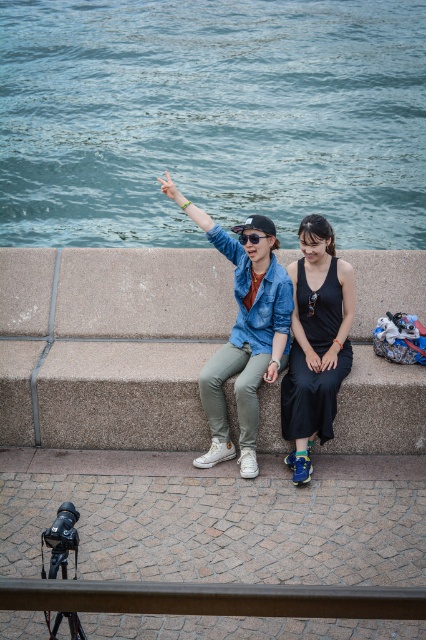
Question: Which point is farther to the camera?

Choices:
 (A) (256, 234)
 (B) (213, 464)
 (C) (100, 300)
 (D) (319, 216)

Answer: (C)

Question: Which is nearer to the blue water at upper center?

Choices:
 (A) concrete ledge at center
 (B) black matte sunglasses at upper center
 (C) denim jacket at center

Answer: (A)

Question: Does blue water at upper center have a greater width compared to black matte sunglasses at upper center?

Choices:
 (A) yes
 (B) no

Answer: (A)

Question: Is concrete ledge at center to the left of denim jacket at center from the viewer's perspective?

Choices:
 (A) no
 (B) yes

Answer: (B)

Question: Is blue water at upper center to the right of concrete ledge at center from the viewer's perspective?

Choices:
 (A) no
 (B) yes

Answer: (A)

Question: Estimate the real-world distances between objects in this image. Which object is closer to the blue water at upper center?

Choices:
 (A) concrete ledge at center
 (B) black matte dress at center
 (C) denim jacket at center
 (D) black matte sunglasses at upper center

Answer: (A)